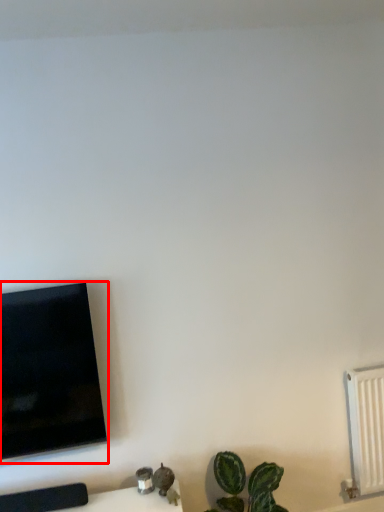
Question: Where is television (annotated by the red box) located in relation to radiator in the image?

Choices:
 (A) left
 (B) right

Answer: (A)